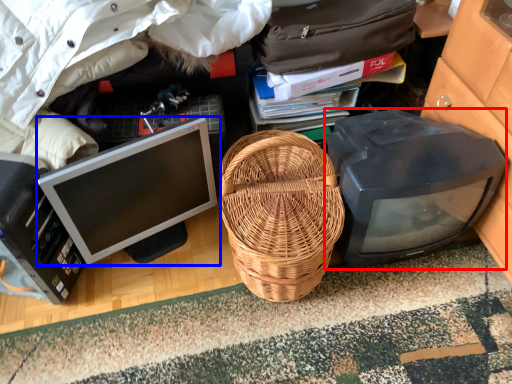
Question: Among these objects, which one is farthest to the camera, computer monitor (highlighted by a red box) or computer monitor (highlighted by a blue box)?

Choices:
 (A) computer monitor
 (B) computer monitor

Answer: (A)